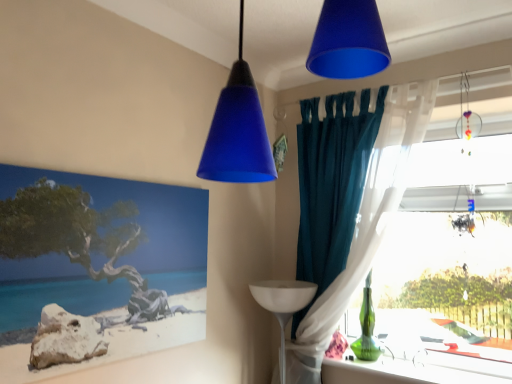
Question: Is translucent glass ornament at upper right, the 2th lamp viewed from the front, wider than transparent glass table at right?

Choices:
 (A) yes
 (B) no

Answer: (A)

Question: Is transparent glass table at right located within translucent glass ornament at upper right, the 1th lamp viewed from the right?

Choices:
 (A) yes
 (B) no

Answer: (B)

Question: From a real-world perspective, is translucent glass ornament at upper right, which ranks as the 1th lamp in back-to-front order, positioned over transparent glass table at right based on gravity?

Choices:
 (A) no
 (B) yes

Answer: (B)

Question: Is translucent glass ornament at upper right, the 2th lamp viewed from the front, positioned beyond the bounds of transparent glass table at right?

Choices:
 (A) no
 (B) yes

Answer: (B)

Question: Can you confirm if translucent glass ornament at upper right, which appears as the 2th lamp when viewed from the left, is taller than transparent glass table at right?

Choices:
 (A) no
 (B) yes

Answer: (A)

Question: Is translucent glass ornament at upper right, the 2th lamp viewed from the front, positioned in front of transparent glass table at right?

Choices:
 (A) no
 (B) yes

Answer: (B)

Question: Is translucent glass ornament at upper right, the 2th lamp viewed from the front, at the left side of matte canvas painting at left?

Choices:
 (A) yes
 (B) no

Answer: (B)

Question: Considering the relative positions of translucent glass ornament at upper right, which ranks as the 1th lamp in back-to-front order, and matte canvas painting at left in the image provided, is translucent glass ornament at upper right, which ranks as the 1th lamp in back-to-front order, to the right of matte canvas painting at left from the viewer's perspective?

Choices:
 (A) yes
 (B) no

Answer: (A)

Question: Is translucent glass ornament at upper right, which appears as the 2th lamp when viewed from the left, not within matte canvas painting at left?

Choices:
 (A) yes
 (B) no

Answer: (A)

Question: From a real-world perspective, is translucent glass ornament at upper right, the 1th lamp viewed from the right, below matte canvas painting at left?

Choices:
 (A) no
 (B) yes

Answer: (A)

Question: Can you confirm if translucent glass ornament at upper right, which ranks as the 1th lamp in back-to-front order, is wider than matte canvas painting at left?

Choices:
 (A) yes
 (B) no

Answer: (A)

Question: Is matte canvas painting at left behind teal fabric curtain at right?

Choices:
 (A) yes
 (B) no

Answer: (B)